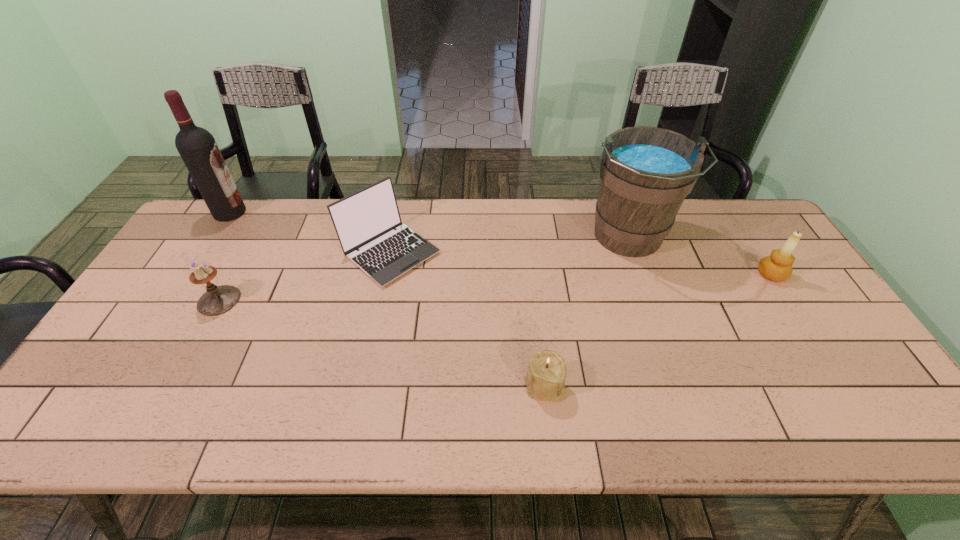
Find the location of `candle holder that is at the left edge`. candle holder that is at the left edge is located at coordinates (217, 300).

Where is `object that is positioned at the right edge`? The image size is (960, 540). object that is positioned at the right edge is located at coordinates (777, 267).

Find the location of `object situated at the far left corner`. object situated at the far left corner is located at coordinates (198, 149).

The image size is (960, 540). I want to click on vacant space at the far edge of the desktop, so click(x=474, y=199).

Locate an element on the screen. The image size is (960, 540). vacant space at the near edge is located at coordinates (562, 431).

Identify the location of free point at the left edge. The width and height of the screenshot is (960, 540). (157, 287).

Find the location of a particular element. free space at the right edge is located at coordinates (831, 349).

Where is `vacant space at the far right corner of the desktop`? The height and width of the screenshot is (540, 960). vacant space at the far right corner of the desktop is located at coordinates (748, 231).

This screenshot has height=540, width=960. Identify the location of vacant area between the laptop_computer and the leftmost candle_holder. (304, 276).

You are a GUI agent. You are given a task and a screenshot of the screen. Output one action in this format:
    pyautogui.click(x=<x>, y=<y>)
    Task: Click on the free space between the tallest object and the fifth object from left to right
    This screenshot has height=540, width=960.
    Given the screenshot: What is the action you would take?
    pyautogui.click(x=429, y=226)